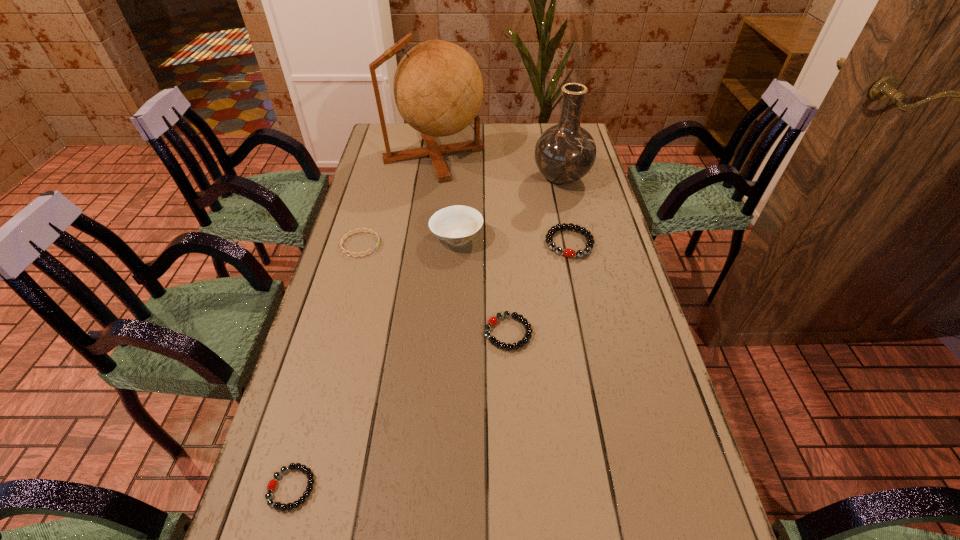
You are a GUI agent. You are given a task and a screenshot of the screen. Output one action in this format:
    pyautogui.click(x=<x>, y=<y>)
    Task: Click on the nearest object
    
    Given the screenshot: What is the action you would take?
    pyautogui.click(x=272, y=484)

I want to click on vacant space located on the surface of the globe, so click(543, 154).

In order to click on free region located on the front of the second tallest object in this screenshot , I will do `click(573, 231)`.

This screenshot has width=960, height=540. Identify the location of vacant point located 0.330m on the front of the beige bowl. (450, 347).

This screenshot has height=540, width=960. What are the coordinates of `vacant space located 0.130m on the left of the tallest bracelet` in the screenshot? It's located at (503, 243).

You are a GUI agent. You are given a task and a screenshot of the screen. Output one action in this format:
    pyautogui.click(x=<x>, y=<y>)
    Task: Click on the vacant space situated on the back of the second nearest black bracelet
    The height and width of the screenshot is (540, 960).
    Given the screenshot: What is the action you would take?
    pyautogui.click(x=506, y=292)

You are a GUI agent. You are given a task and a screenshot of the screen. Output one action in this format:
    pyautogui.click(x=<x>, y=<y>)
    Task: Click on the vacant space located 0.230m on the surface of the blue bracelet showing star-shaped elements
    The height and width of the screenshot is (540, 960).
    Given the screenshot: What is the action you would take?
    pyautogui.click(x=455, y=244)

You are a GUI agent. You are given a task and a screenshot of the screen. Output one action in this format:
    pyautogui.click(x=<x>, y=<y>)
    Task: Click on the blank space located on the right of the nearest black bracelet
    Image resolution: width=960 pixels, height=540 pixels.
    Given the screenshot: What is the action you would take?
    pyautogui.click(x=361, y=488)

At what (x,y) coordinates should I click in order to perform the action: click on object that is positioned at the far edge. Please return your answer as a coordinate pair (x, y). The width and height of the screenshot is (960, 540). Looking at the image, I should click on (438, 89).

Locate an element on the screen. The height and width of the screenshot is (540, 960). globe present at the left edge is located at coordinates (438, 89).